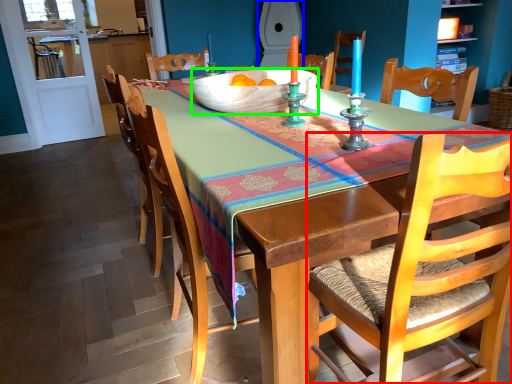
Question: Considering the real-world distances, which object is closest to chair (highlighted by a red box)? toilet (highlighted by a blue box) or bowl (highlighted by a green box).

Choices:
 (A) toilet
 (B) bowl

Answer: (B)